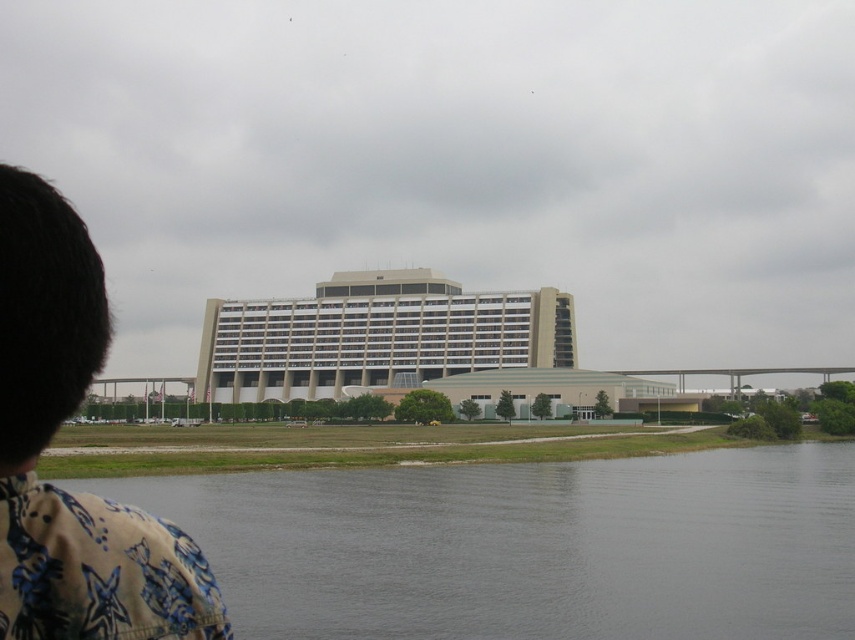
In the scene shown: Is the position of brown fabric shirt at left more distant than that of beige concrete building at center?

No, brown fabric shirt at left is closer to the viewer.

Does brown fabric shirt at left have a lesser height compared to beige concrete building at center?

Yes.

Is point (3, 358) less distant than point (351, 346)?

Yes, it is.

Where is `brown fabric shirt at left`? brown fabric shirt at left is located at coordinates (50, 440).

Who is more forward, [476,624] or [245,387]?

Point [476,624]

Is gray smooth water at lower center further to the viewer compared to beige concrete building at center?

No.

Which is in front, point (422, 572) or point (226, 339)?

Point (422, 572) is more forward.

The height and width of the screenshot is (640, 855). Identify the location of gray smooth water at lower center. (528, 547).

Can you confirm if gray smooth water at lower center is positioned below brown fabric shirt at left?

Indeed, gray smooth water at lower center is positioned under brown fabric shirt at left.

Who is more distant from viewer, [145,493] or [27,540]?

Point [145,493]

You are a GUI agent. You are given a task and a screenshot of the screen. Output one action in this format:
    pyautogui.click(x=<x>, y=<y>)
    Task: Click on the gray smooth water at lower center
    This screenshot has height=640, width=855.
    Given the screenshot: What is the action you would take?
    pyautogui.click(x=528, y=547)